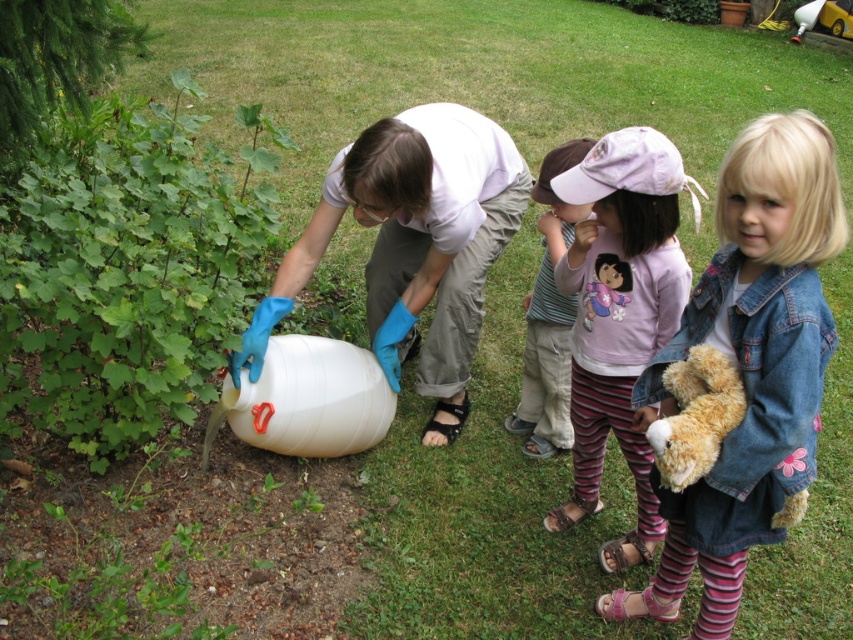
You are a delivery robot that needs to place a package at the exact location of the brown plush teddy bear at lower right. The robot can only move in straight lines and cannot pass through any objects. Given the scene described, can you safely navigate to the teddy bear without hitting any obstacles?

The brown plush teddy bear at lower right is located at coordinates point [695,416]. Since there are no other objects mentioned in the scene that would block the path, the delivery robot can safely navigate to the teddy bear in a straight line without encountering obstacles.

You are a delivery person who needs to place a small package on the ground near the denim jacket at lower right. What are the coordinates where you should place the package?

The coordinates for the denim jacket at lower right are at point (750, 364), so you should place the package near those coordinates.

You are a child who wants to pick up both the brown plush teddy bear at lower right and the fuzzy brown teddy bear at lower right. Which one is taller?

The brown plush teddy bear at lower right is taller than the fuzzy brown teddy bear at lower right.